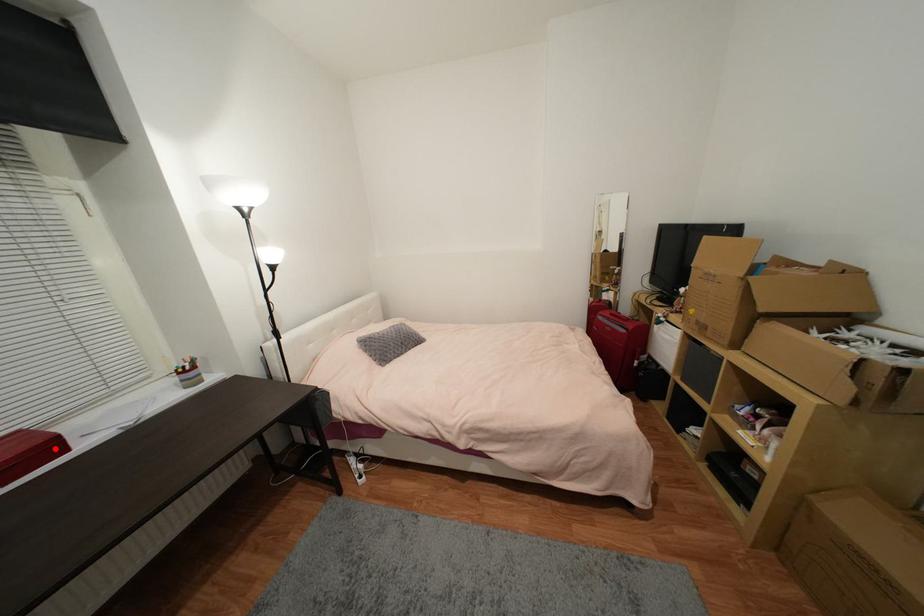
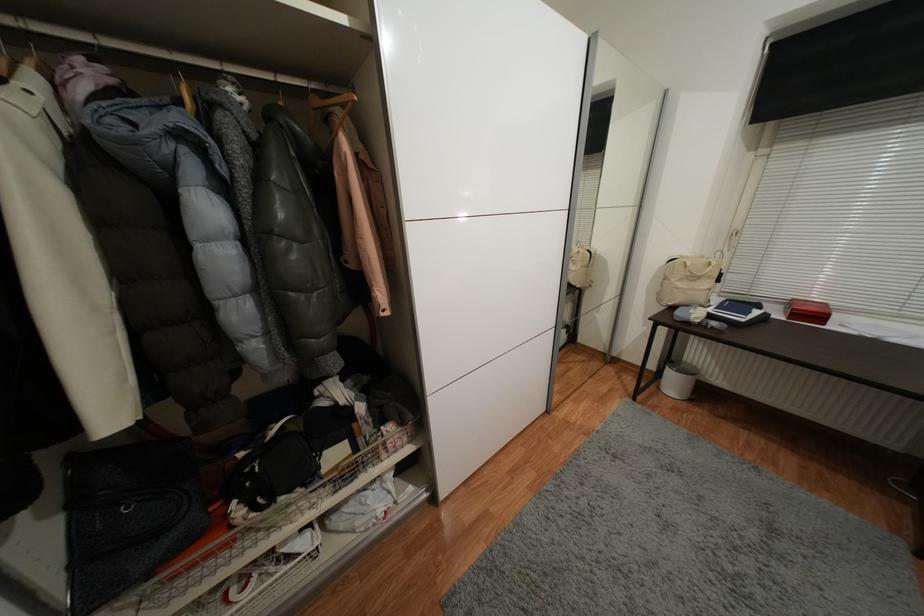
Locate, in the second image, the point that corresponds to the highlighted location in the first image.

(824, 318)